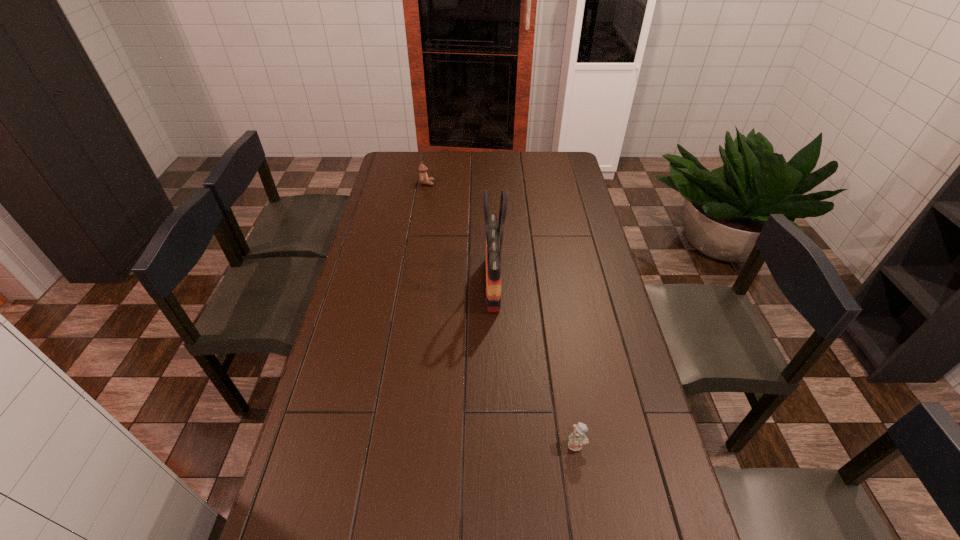
You are a GUI agent. You are given a task and a screenshot of the screen. Output one action in this format:
    pyautogui.click(x=<x>, y=<y>)
    Task: Click on the object that is the second closest to the tallest object
    The height and width of the screenshot is (540, 960).
    Given the screenshot: What is the action you would take?
    pyautogui.click(x=423, y=177)

Locate which object ranks second in proximity to the shorter teddy bear. Please provide its 2D coordinates. Your answer should be formatted as a tuple, i.e. [(x, y)], where the tuple contains the x and y coordinates of a point satisfying the conditions above.

[(423, 177)]

Where is `teddy bear that is the second closest to the second nearest object`? Image resolution: width=960 pixels, height=540 pixels. teddy bear that is the second closest to the second nearest object is located at coordinates (423, 177).